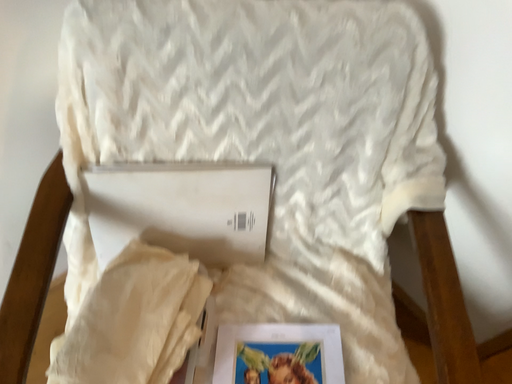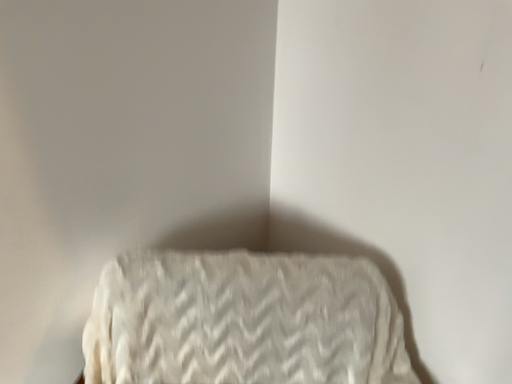
Question: Which way did the camera rotate in the video?

Choices:
 (A) rotated downward
 (B) rotated upward

Answer: (B)